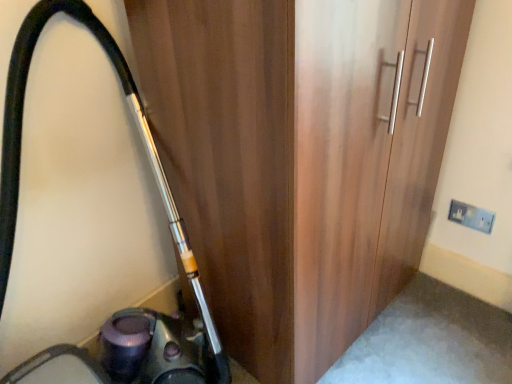
Describe the element at coordinates (300, 158) in the screenshot. I see `wooden wardrobe at center` at that location.

Describe the element at coordinates (471, 216) in the screenshot. The image size is (512, 384). I see `white plastic electric outlet at upper right` at that location.

Describe the element at coordinates (170, 229) in the screenshot. Image resolution: width=512 pixels, height=384 pixels. I see `metallic vacuum cleaner at left` at that location.

Locate an element on the screen. This screenshot has height=384, width=512. wooden wardrobe at center is located at coordinates (300, 158).

Is wooden wardrobe at center surrounding white plastic electric outlet at upper right?

No, white plastic electric outlet at upper right is not inside wooden wardrobe at center.

This screenshot has width=512, height=384. In order to click on door on the left of white plastic electric outlet at upper right in this screenshot , I will do `click(300, 158)`.

Can you see wooden wardrobe at center touching white plastic electric outlet at upper right?

No.

Is wooden wardrobe at center further to the viewer compared to white plastic electric outlet at upper right?

No.

In terms of size, does wooden wardrobe at center appear bigger or smaller than metallic vacuum cleaner at left?

In the image, wooden wardrobe at center appears to be larger than metallic vacuum cleaner at left.

In the image, is wooden wardrobe at center on the left side or the right side of metallic vacuum cleaner at left?

From the image, it's evident that wooden wardrobe at center is to the right of metallic vacuum cleaner at left.

Considering the positions of objects wooden wardrobe at center and metallic vacuum cleaner at left in the image provided, who is in front, wooden wardrobe at center or metallic vacuum cleaner at left?

Positioned in front is metallic vacuum cleaner at left.

Based on the photo, is wooden wardrobe at center outside of metallic vacuum cleaner at left?

That's correct, wooden wardrobe at center is outside of metallic vacuum cleaner at left.

Is wooden wardrobe at center at the back of white plastic electric outlet at upper right?

That's not correct — white plastic electric outlet at upper right is not looking away from wooden wardrobe at center.

Is white plastic electric outlet at upper right closer to the viewer compared to wooden wardrobe at center?

No, white plastic electric outlet at upper right is further to the viewer.

Is white plastic electric outlet at upper right situated inside wooden wardrobe at center or outside?

white plastic electric outlet at upper right is not enclosed by wooden wardrobe at center.

Visually, is white plastic electric outlet at upper right positioned to the left or to the right of wooden wardrobe at center?

From the image, it's evident that white plastic electric outlet at upper right is to the right of wooden wardrobe at center.

Is there a large distance between metallic vacuum cleaner at left and wooden wardrobe at center?

metallic vacuum cleaner at left is near wooden wardrobe at center, not far away.

Is metallic vacuum cleaner at left thinner than wooden wardrobe at center?

In fact, metallic vacuum cleaner at left might be wider than wooden wardrobe at center.

From the image's perspective, is metallic vacuum cleaner at left located above wooden wardrobe at center?

Actually, metallic vacuum cleaner at left appears below wooden wardrobe at center in the image.

Can you confirm if metallic vacuum cleaner at left is shorter than wooden wardrobe at center?

Incorrect, the height of metallic vacuum cleaner at left does not fall short of that of wooden wardrobe at center.

From a real-world perspective, is white plastic electric outlet at upper right beneath metallic vacuum cleaner at left?

Correct, in the physical world, white plastic electric outlet at upper right is lower than metallic vacuum cleaner at left.

Consider the image. Considering the relative positions of white plastic electric outlet at upper right and metallic vacuum cleaner at left in the image provided, is white plastic electric outlet at upper right in front of metallic vacuum cleaner at left?

No, white plastic electric outlet at upper right is further to the viewer.

From the image's perspective, which object appears higher, white plastic electric outlet at upper right or metallic vacuum cleaner at left?

white plastic electric outlet at upper right is shown above in the image.

I want to click on equipment below the white plastic electric outlet at upper right (from the image's perspective), so click(x=170, y=229).

Looking at the image, does metallic vacuum cleaner at left seem bigger or smaller compared to white plastic electric outlet at upper right?

Considering their sizes, metallic vacuum cleaner at left takes up more space than white plastic electric outlet at upper right.

Which of these two, metallic vacuum cleaner at left or white plastic electric outlet at upper right, stands taller?

With more height is metallic vacuum cleaner at left.

From the picture: Is metallic vacuum cleaner at left at the left side of white plastic electric outlet at upper right?

Yes.

Does metallic vacuum cleaner at left come behind white plastic electric outlet at upper right?

No, metallic vacuum cleaner at left is closer to the viewer.

The width and height of the screenshot is (512, 384). I want to click on electric outlet behind the wooden wardrobe at center, so click(471, 216).

Locate an element on the screen. Image resolution: width=512 pixels, height=384 pixels. door above the metallic vacuum cleaner at left (from a real-world perspective) is located at coordinates pyautogui.click(x=300, y=158).

Considering their positions, is wooden wardrobe at center positioned closer to white plastic electric outlet at upper right than metallic vacuum cleaner at left?

Among the two, wooden wardrobe at center is located nearer to white plastic electric outlet at upper right.

When comparing their distances from white plastic electric outlet at upper right, does metallic vacuum cleaner at left or wooden wardrobe at center seem closer?

Based on the image, wooden wardrobe at center appears to be nearer to white plastic electric outlet at upper right.

When comparing their distances from metallic vacuum cleaner at left, does white plastic electric outlet at upper right or wooden wardrobe at center seem further?

white plastic electric outlet at upper right is further to metallic vacuum cleaner at left.

Which object lies nearer to the anchor point wooden wardrobe at center, white plastic electric outlet at upper right or metallic vacuum cleaner at left?

Among the two, metallic vacuum cleaner at left is located nearer to wooden wardrobe at center.

Based on their spatial positions, is metallic vacuum cleaner at left or white plastic electric outlet at upper right closer to wooden wardrobe at center?

metallic vacuum cleaner at left lies closer to wooden wardrobe at center than the other object.

Based on their spatial positions, is wooden wardrobe at center or white plastic electric outlet at upper right closer to metallic vacuum cleaner at left?

wooden wardrobe at center.

This screenshot has width=512, height=384. I want to click on door between metallic vacuum cleaner at left and white plastic electric outlet at upper right from front to back, so click(300, 158).